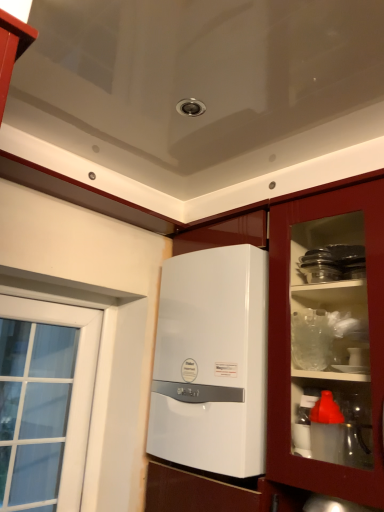
The image size is (384, 512). I want to click on white glossy cabinet at center, so click(x=290, y=374).

The image size is (384, 512). What do you see at coordinates (290, 374) in the screenshot?
I see `white glossy cabinet at center` at bounding box center [290, 374].

This screenshot has height=512, width=384. What do you see at coordinates (212, 362) in the screenshot?
I see `white glossy boiler at center` at bounding box center [212, 362].

Image resolution: width=384 pixels, height=512 pixels. I want to click on white glossy boiler at center, so click(x=212, y=362).

Image resolution: width=384 pixels, height=512 pixels. Find the location of `white glossy cabinet at center`. white glossy cabinet at center is located at coordinates (290, 374).

In the image, is white glossy boiler at center on the left side or the right side of white glossy cabinet at center?

Clearly, white glossy boiler at center is on the right of white glossy cabinet at center in the image.

In the image, is white glossy boiler at center positioned in front of or behind white glossy cabinet at center?

Visually, white glossy boiler at center is located behind white glossy cabinet at center.

Which is in front, point (161, 279) or point (281, 255)?

Positioned in front is point (281, 255).

From the image's perspective, relative to white glossy cabinet at center, is white glossy boiler at center above or below?

From the image's perspective, white glossy boiler at center appears above white glossy cabinet at center.

From a real-world perspective, which is physically below, white glossy boiler at center or white glossy cabinet at center?

In real-world perspective, white glossy cabinet at center is lower.

Considering the relative sizes of white glossy boiler at center and white glossy cabinet at center in the image provided, is white glossy boiler at center thinner than white glossy cabinet at center?

Yes.

Looking at this image, is white glossy boiler at center shorter than white glossy cabinet at center?

Correct, white glossy boiler at center is not as tall as white glossy cabinet at center.

Based on their sizes in the image, would you say white glossy boiler at center is bigger or smaller than white glossy cabinet at center?

Considering their sizes, white glossy boiler at center takes up less space than white glossy cabinet at center.

Is white glossy cabinet at center completely or partially inside white glossy boiler at center?

Yes, white glossy cabinet at center can be found within white glossy boiler at center.

Is white glossy boiler at center in contact with white glossy cabinet at center?

No, white glossy boiler at center is not in contact with white glossy cabinet at center.

Is white glossy boiler at center facing away from white glossy cabinet at center?

Correct, white glossy boiler at center is looking away from white glossy cabinet at center.

How many degrees apart are the facing directions of white glossy boiler at center and white glossy cabinet at center?

1.24 degrees.

How far apart are white glossy boiler at center and white glossy cabinet at center?

They are 6.86 inches apart.

This screenshot has width=384, height=512. Identify the location of home appliance located on the right of white glossy cabinet at center. (212, 362).

Is white glossy cabinet at center at the right side of white glossy boiler at center?

Incorrect, white glossy cabinet at center is not on the right side of white glossy boiler at center.

Which is in front, white glossy cabinet at center or white glossy boiler at center?

white glossy cabinet at center is more forward.

Does point (246, 495) come closer to viewer compared to point (155, 393)?

Yes, point (246, 495) is in front of point (155, 393).

From the image's perspective, does white glossy cabinet at center appear lower than white glossy boiler at center?

Yes.

From a real-world perspective, between white glossy cabinet at center and white glossy boiler at center, who is vertically lower?

In real-world perspective, white glossy cabinet at center is lower.

Can you confirm if white glossy cabinet at center is thinner than white glossy boiler at center?

In fact, white glossy cabinet at center might be wider than white glossy boiler at center.

In terms of height, does white glossy cabinet at center look taller or shorter compared to white glossy boiler at center?

white glossy cabinet at center is taller than white glossy boiler at center.

Between white glossy cabinet at center and white glossy boiler at center, which one has smaller size?

Smaller between the two is white glossy boiler at center.

Is white glossy boiler at center located within white glossy cabinet at center?

Yes.

Consider the image. Would you consider white glossy cabinet at center to be distant from white glossy boiler at center?

No.

Is white glossy boiler at center at the back of white glossy cabinet at center?

Yes, white glossy cabinet at center's orientation is away from white glossy boiler at center.

How many degrees apart are the facing directions of white glossy cabinet at center and white glossy boiler at center?

white glossy cabinet at center and white glossy boiler at center are facing 1.24 degrees away from each other.

How much distance is there between white glossy cabinet at center and white glossy boiler at center?

They are 6.86 inches apart.

Locate an element on the screen. The width and height of the screenshot is (384, 512). home appliance above the white glossy cabinet at center (from the image's perspective) is located at coordinates (212, 362).

The width and height of the screenshot is (384, 512). In the image, there is a white glossy cabinet at center. Find the location of `home appliance above it (from the image's perspective)`. home appliance above it (from the image's perspective) is located at coordinates (212, 362).

The height and width of the screenshot is (512, 384). I want to click on cabinetry in front of the white glossy boiler at center, so click(x=290, y=374).